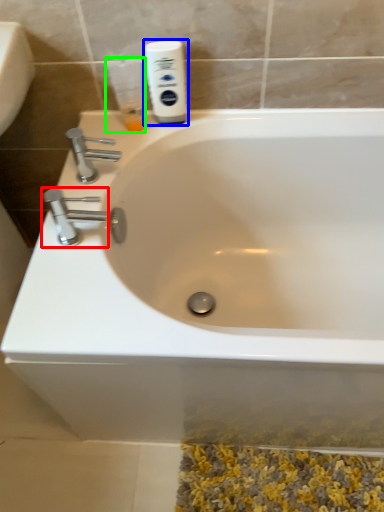
Question: Based on their relative distances, which object is nearer to tap (highlighted by a red box)? Choose from shaving cream (highlighted by a blue box) and mouthwash (highlighted by a green box).

Choices:
 (A) shaving cream
 (B) mouthwash

Answer: (B)